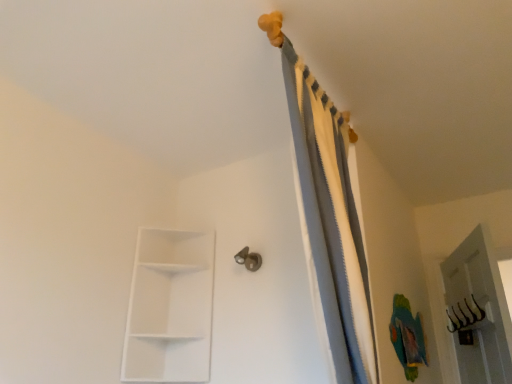
Question: Could you tell me if white matte/shelf at lower left is facing gray fabric curtain at upper center?

Choices:
 (A) yes
 (B) no

Answer: (B)

Question: Would you consider white matte/shelf at lower left to be distant from gray fabric curtain at upper center?

Choices:
 (A) no
 (B) yes

Answer: (A)

Question: From the image's perspective, is white matte/shelf at lower left on top of gray fabric curtain at upper center?

Choices:
 (A) yes
 (B) no

Answer: (B)

Question: Can you confirm if white matte/shelf at lower left is smaller than gray fabric curtain at upper center?

Choices:
 (A) yes
 (B) no

Answer: (A)

Question: From the image's perspective, is white matte/shelf at lower left located beneath gray fabric curtain at upper center?

Choices:
 (A) yes
 (B) no

Answer: (A)

Question: Is white matte/shelf at lower left in front of or behind metallic silver door handle at center in the image?

Choices:
 (A) front
 (B) behind

Answer: (A)

Question: From the image's perspective, is white matte/shelf at lower left located above or below metallic silver door handle at center?

Choices:
 (A) above
 (B) below

Answer: (B)

Question: Is white matte/shelf at lower left spatially inside metallic silver door handle at center, or outside of it?

Choices:
 (A) inside
 (B) outside

Answer: (B)

Question: In the image, is white matte/shelf at lower left on the left side or the right side of metallic silver door handle at center?

Choices:
 (A) left
 (B) right

Answer: (A)

Question: Choose the correct answer: Is gray fabric curtain at upper center inside white matte/shelf at lower left or outside it?

Choices:
 (A) inside
 (B) outside

Answer: (B)

Question: In terms of width, does gray fabric curtain at upper center look wider or thinner when compared to white matte/shelf at lower left?

Choices:
 (A) wide
 (B) thin

Answer: (B)

Question: In the image, is gray fabric curtain at upper center on the left side or the right side of white matte/shelf at lower left?

Choices:
 (A) right
 (B) left

Answer: (A)

Question: Considering their positions, is gray fabric curtain at upper center located in front of or behind white matte/shelf at lower left?

Choices:
 (A) front
 (B) behind

Answer: (A)

Question: Considering the positions of metallic silver door handle at center and gray fabric curtain at upper center in the image, is metallic silver door handle at center bigger or smaller than gray fabric curtain at upper center?

Choices:
 (A) small
 (B) big

Answer: (A)

Question: Considering the relative positions of metallic silver door handle at center and gray fabric curtain at upper center in the image provided, is metallic silver door handle at center to the left or to the right of gray fabric curtain at upper center?

Choices:
 (A) right
 (B) left

Answer: (B)